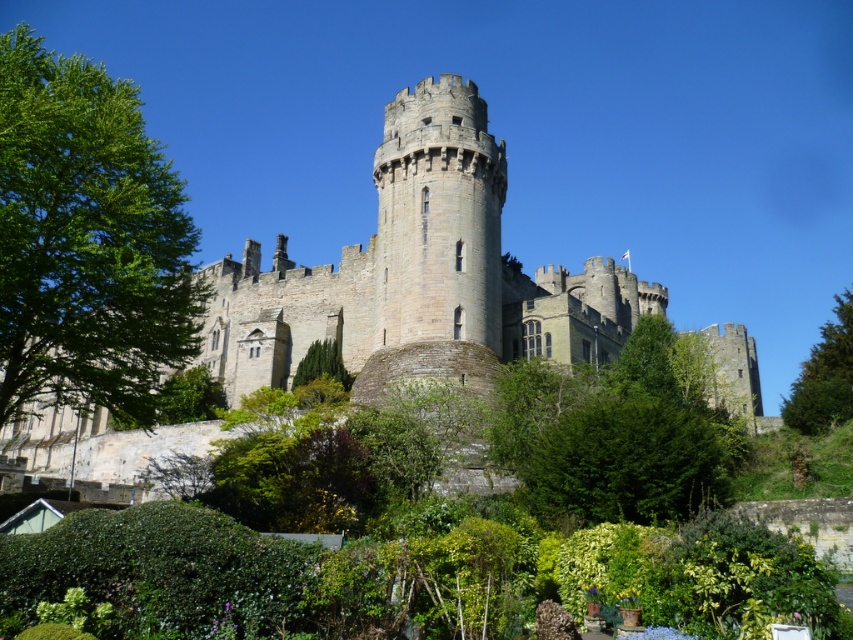
Question: Is green leafy tree at left thinner than green textured tree at center?

Choices:
 (A) no
 (B) yes

Answer: (A)

Question: Which object is the farthest from the green leafy tree at left?

Choices:
 (A) gray stone castle at center
 (B) green leafy hedge at lower center

Answer: (A)

Question: Which of these objects is positioned closest to the green leafy tree at upper right?

Choices:
 (A) gray stone castle at center
 (B) green textured tree at center
 (C) green leafy tree at center
 (D) green leafy tree at left

Answer: (A)

Question: Is green leafy tree at left smaller than green leafy hedge at lower center?

Choices:
 (A) yes
 (B) no

Answer: (B)

Question: Which of the following is the closest to the observer?

Choices:
 (A) green leafy hedge at lower center
 (B) green leafy tree at upper right
 (C) green leafy tree at center

Answer: (A)

Question: Is green leafy tree at left wider than green textured tree at center?

Choices:
 (A) yes
 (B) no

Answer: (A)